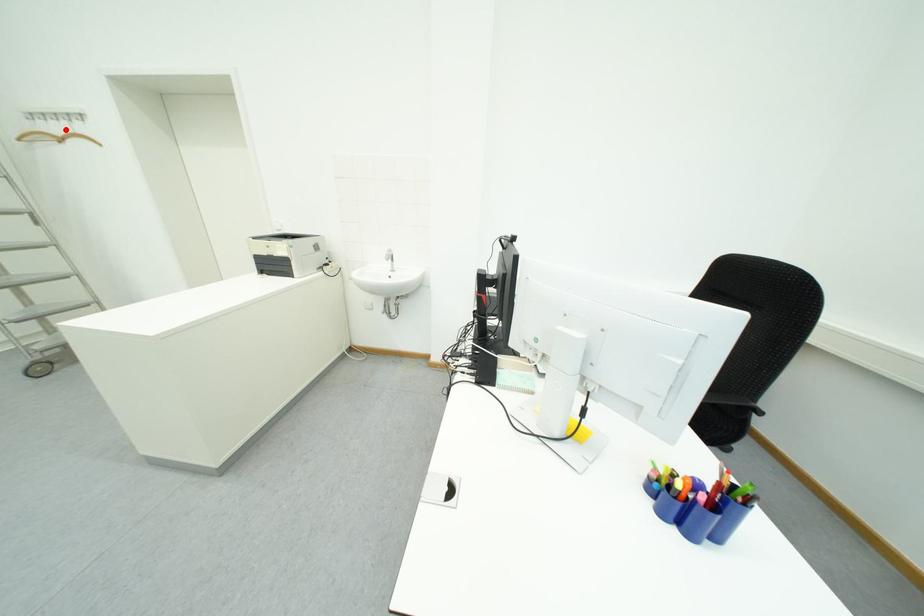
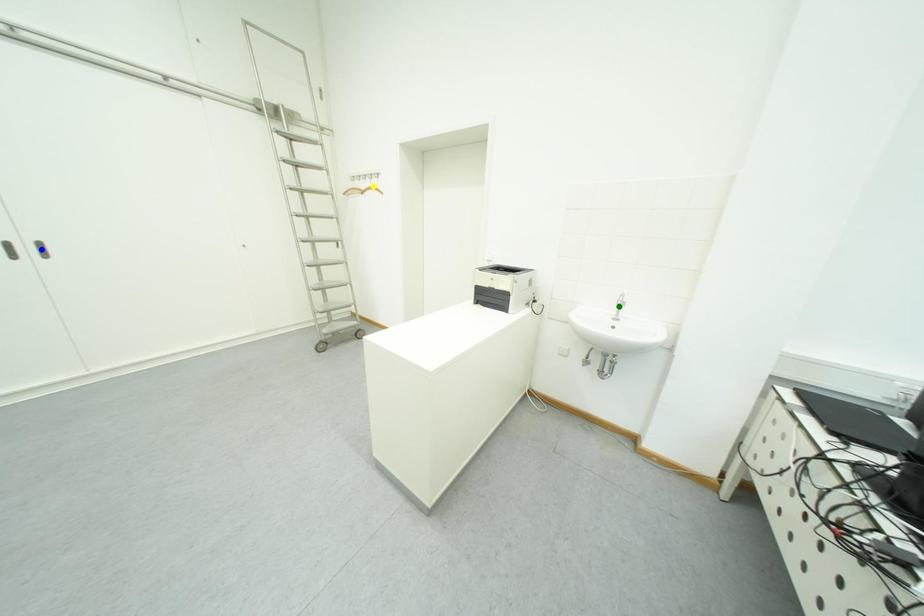
Question: I am providing you with two images of the same scene from different viewpoints. A red point is marked on the first image. You are given multiple points on the second image. Which point in image 2 represents the same 3d spot as the red point in image 1?

Choices:
 (A) blue point
 (B) yellow point
 (C) green point

Answer: (B)